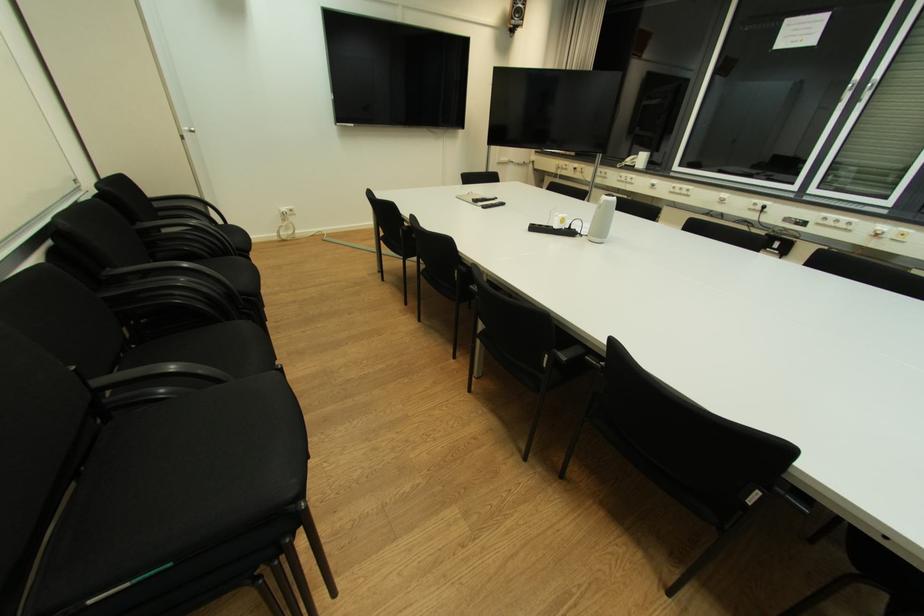
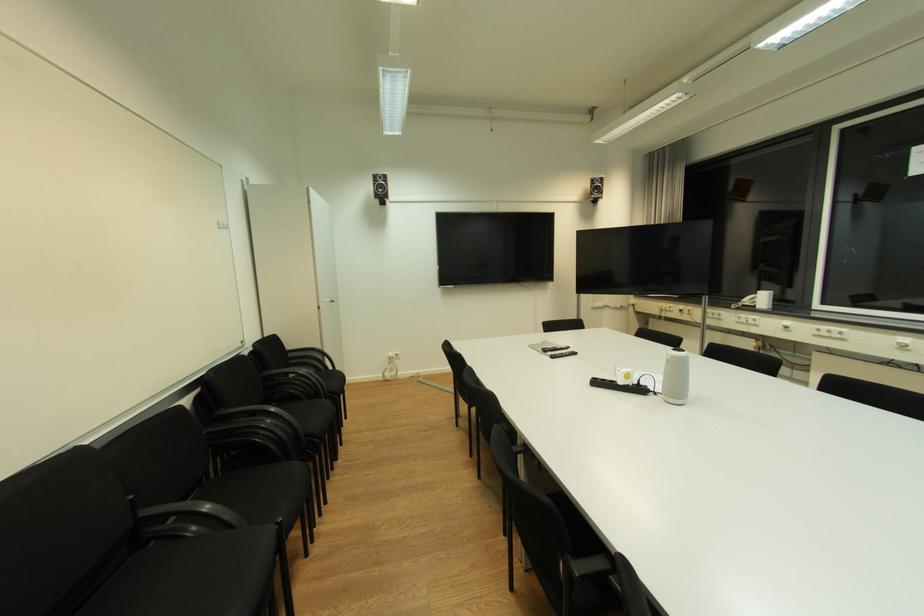
Where in the second image is the point corresponding to the point at 80,368 from the first image?

(137, 498)